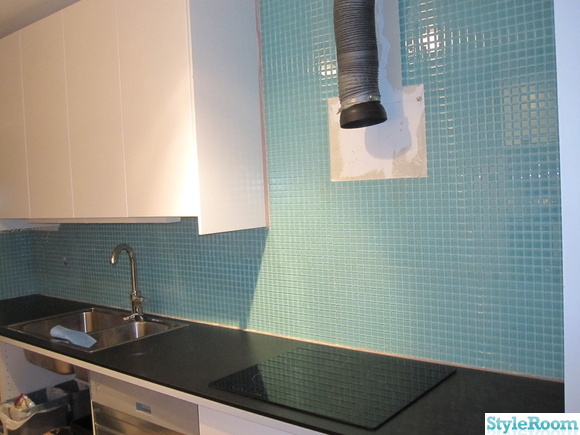
You are a GUI agent. You are given a task and a screenshot of the screen. Output one action in this format:
    pyautogui.click(x=<x>, y=<y>)
    Task: Click on the tap
    The image size is (580, 435).
    Given the screenshot: What is the action you would take?
    pyautogui.click(x=134, y=276)